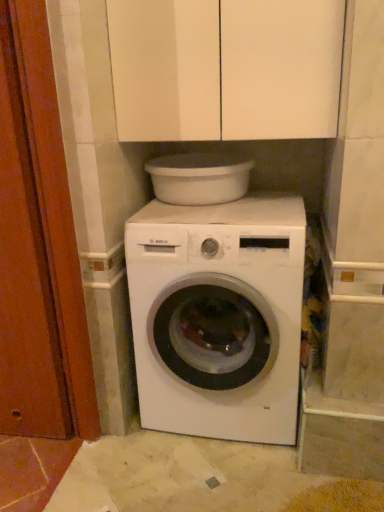
Image resolution: width=384 pixels, height=512 pixels. Describe the element at coordinates (218, 317) in the screenshot. I see `white matte washing machine at center` at that location.

This screenshot has height=512, width=384. What do you see at coordinates (38, 246) in the screenshot?
I see `wooden door at left` at bounding box center [38, 246].

Locate an element on the screen. Image resolution: width=384 pixels, height=512 pixels. white matte washing machine at center is located at coordinates (218, 317).

How many degrees apart are the facing directions of white matte cabinet at upper center and white matte washing machine at center?

0.668 degrees.

From the image's perspective, would you say white matte cabinet at upper center is positioned over white matte washing machine at center?

Yes, from the image's perspective, white matte cabinet at upper center is over white matte washing machine at center.

Would you consider white matte cabinet at upper center to be distant from white matte washing machine at center?

No, white matte cabinet at upper center is not far from white matte washing machine at center.

Would you say white matte cabinet at upper center is outside white matte washing machine at center?

white matte cabinet at upper center lies outside white matte washing machine at center's area.

The height and width of the screenshot is (512, 384). I want to click on door directly beneath the white matte cabinet at upper center (from a real-world perspective), so click(38, 246).

Is point (89, 408) closer to camera compared to point (282, 126)?

No, it is not.

Who is bigger, wooden door at left or white matte cabinet at upper center?

Bigger between the two is white matte cabinet at upper center.

From a real-world perspective, is wooden door at left physically above white matte cabinet at upper center?

Actually, wooden door at left is physically below white matte cabinet at upper center in the real world.

Locate an element on the screen. The height and width of the screenshot is (512, 384). cabinetry on the right of white matte washing machine at center is located at coordinates (225, 68).

How many degrees apart are the facing directions of white matte washing machine at center and white matte cabinet at upper center?

The angle between the facing direction of white matte washing machine at center and the facing direction of white matte cabinet at upper center is 0.668 degrees.

Does point (201, 303) come behind point (277, 54)?

Yes.

Considering the positions of objects white matte washing machine at center and white matte cabinet at upper center in the image provided, who is behind, white matte washing machine at center or white matte cabinet at upper center?

white matte washing machine at center is further from the camera.

From the image's perspective, which is below, white matte washing machine at center or white plastic basin at upper center?

white matte washing machine at center is shown below in the image.

Which is more to the left, white matte washing machine at center or white plastic basin at upper center?

white plastic basin at upper center.

Is white matte washing machine at center closer to the viewer compared to white plastic basin at upper center?

Yes, the depth of white matte washing machine at center is less than that of white plastic basin at upper center.

Could you tell me if white matte washing machine at center is turned towards white plastic basin at upper center?

No, white matte washing machine at center is not turned towards white plastic basin at upper center.

Is wooden door at left at the back of white matte cabinet at upper center?

No, white matte cabinet at upper center is not facing away from wooden door at left.

From the image's perspective, which one is positioned lower, white matte cabinet at upper center or wooden door at left?

From the image's view, wooden door at left is below.

Considering the sizes of objects white matte cabinet at upper center and wooden door at left in the image provided, who is smaller, white matte cabinet at upper center or wooden door at left?

Smaller between the two is wooden door at left.

Can you confirm if white matte cabinet at upper center is taller than wooden door at left?

No.

Is white matte washing machine at center positioned behind wooden door at left?

Yes, it is.

Could you tell me if white matte washing machine at center is facing wooden door at left?

No.

Are white matte washing machine at center and wooden door at left beside each other?

No, white matte washing machine at center is not in contact with wooden door at left.

Choose the correct answer: Is white matte cabinet at upper center inside white plastic basin at upper center or outside it?

The correct answer is: outside.

From a real-world perspective, does white matte cabinet at upper center sit lower than white plastic basin at upper center?

No, from a real-world perspective, white matte cabinet at upper center is not below white plastic basin at upper center.

Is white matte cabinet at upper center facing towards white plastic basin at upper center?

No, white matte cabinet at upper center is not turned towards white plastic basin at upper center.

Is white matte cabinet at upper center far away from white plastic basin at upper center?

No.

Image resolution: width=384 pixels, height=512 pixels. In order to click on washing machine behind the white matte cabinet at upper center in this screenshot , I will do `click(218, 317)`.

The height and width of the screenshot is (512, 384). I want to click on door in front of the white matte cabinet at upper center, so click(38, 246).

Looking at the image, which one is located further to wooden door at left, white matte washing machine at center or white matte cabinet at upper center?

white matte cabinet at upper center.

Estimate the real-world distances between objects in this image. Which object is further from wooden door at left, white matte cabinet at upper center or white matte washing machine at center?

white matte cabinet at upper center is positioned further to the anchor wooden door at left.

From the image, which object appears to be farther from white plastic basin at upper center, wooden door at left or white matte cabinet at upper center?

wooden door at left.

In the scene shown: Which object lies further to the anchor point white matte cabinet at upper center, white matte washing machine at center or wooden door at left?

Among the two, white matte washing machine at center is located further to white matte cabinet at upper center.

Considering their positions, is white matte cabinet at upper center positioned further to white plastic basin at upper center than white matte washing machine at center?

white matte washing machine at center is positioned further to the anchor white plastic basin at upper center.

When comparing their distances from white matte washing machine at center, does white plastic basin at upper center or white matte cabinet at upper center seem further?

The object further to white matte washing machine at center is white matte cabinet at upper center.

Estimate the real-world distances between objects in this image. Which object is closer to white matte cabinet at upper center, wooden door at left or white matte washing machine at center?

Based on the image, wooden door at left appears to be nearer to white matte cabinet at upper center.

From the image, which object appears to be farther from white matte cabinet at upper center, white plastic basin at upper center or wooden door at left?

wooden door at left lies further to white matte cabinet at upper center than the other object.

Find the location of a particular element. The width and height of the screenshot is (384, 512). washing machine positioned between wooden door at left and white plastic basin at upper center from near to far is located at coordinates (218, 317).

Where is `appliance that lies between white matte cabinet at upper center and white matte washing machine at center from top to bottom`? This screenshot has width=384, height=512. appliance that lies between white matte cabinet at upper center and white matte washing machine at center from top to bottom is located at coordinates (199, 178).

Locate an element on the screen. door that lies between white matte cabinet at upper center and white matte washing machine at center from top to bottom is located at coordinates (38, 246).

Find the location of a particular element. This screenshot has width=384, height=512. cabinetry between wooden door at left and white plastic basin at upper center from front to back is located at coordinates (225, 68).